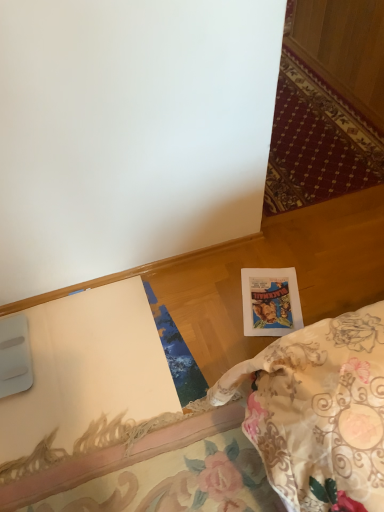
Question: Is printed paper postcard at lower right shorter than white paper at lower right?

Choices:
 (A) no
 (B) yes

Answer: (B)

Question: Can you confirm if printed paper postcard at lower right is positioned to the right of white paper at lower right?

Choices:
 (A) no
 (B) yes

Answer: (B)

Question: Is white paper at lower right completely or partially inside printed paper postcard at lower right?

Choices:
 (A) yes
 (B) no

Answer: (B)

Question: Is the surface of printed paper postcard at lower right in direct contact with white paper at lower right?

Choices:
 (A) yes
 (B) no

Answer: (B)

Question: Can you confirm if printed paper postcard at lower right is taller than white paper at lower right?

Choices:
 (A) no
 (B) yes

Answer: (A)

Question: Does printed paper postcard at lower right have a larger size compared to white paper at lower right?

Choices:
 (A) yes
 (B) no

Answer: (B)

Question: Can you confirm if white paper at lower right is wider than printed paper postcard at lower right?

Choices:
 (A) yes
 (B) no

Answer: (A)

Question: From a real-world perspective, is white paper at lower right below printed paper postcard at lower right?

Choices:
 (A) yes
 (B) no

Answer: (B)

Question: Is white paper at lower right aimed at printed paper postcard at lower right?

Choices:
 (A) no
 (B) yes

Answer: (B)

Question: Is printed paper postcard at lower right at the back of white paper at lower right?

Choices:
 (A) yes
 (B) no

Answer: (A)

Question: Considering the relative sizes of white paper at lower right and printed paper postcard at lower right in the image provided, is white paper at lower right thinner than printed paper postcard at lower right?

Choices:
 (A) yes
 (B) no

Answer: (B)

Question: Is white paper at lower right not near printed paper postcard at lower right?

Choices:
 (A) no
 (B) yes

Answer: (A)

Question: From a real-world perspective, is printed paper postcard at lower right above or below white paper at lower right?

Choices:
 (A) below
 (B) above

Answer: (A)